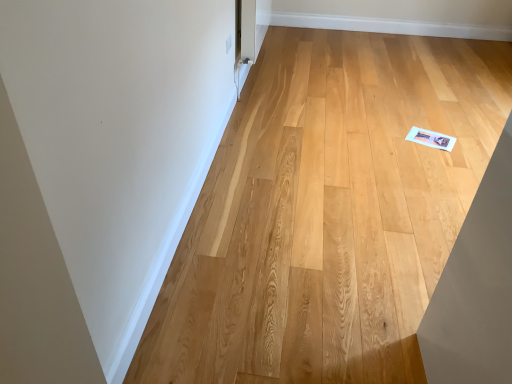
Image resolution: width=512 pixels, height=384 pixels. I want to click on white glossy door at upper center, so click(245, 38).

What do you see at coordinates (245, 38) in the screenshot? The image size is (512, 384). I see `white glossy door at upper center` at bounding box center [245, 38].

This screenshot has width=512, height=384. In order to click on white glossy door at upper center in this screenshot , I will do `click(245, 38)`.